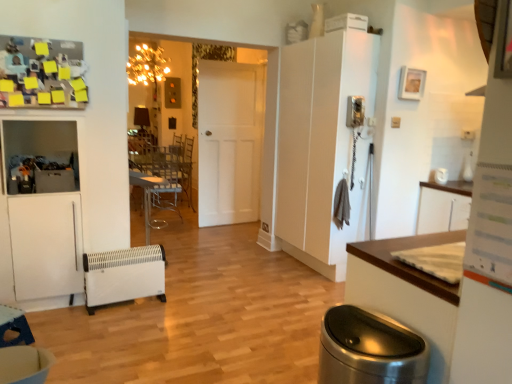
Question: Does polished stainless steel trash can at lower right contain white matte cabinet at right?

Choices:
 (A) yes
 (B) no

Answer: (B)

Question: Is there a large distance between polished stainless steel trash can at lower right and white matte cabinet at right?

Choices:
 (A) yes
 (B) no

Answer: (A)

Question: From a real-world perspective, does polished stainless steel trash can at lower right sit lower than white matte cabinet at right?

Choices:
 (A) yes
 (B) no

Answer: (A)

Question: Does polished stainless steel trash can at lower right have a lesser height compared to white matte cabinet at right?

Choices:
 (A) no
 (B) yes

Answer: (B)

Question: Does polished stainless steel trash can at lower right turn towards white matte cabinet at right?

Choices:
 (A) no
 (B) yes

Answer: (A)

Question: Considering the positions of white matte door at center and metallic silver table at center, arranged as the first table when viewed from the right, in the image, is white matte door at center wider or thinner than metallic silver table at center, arranged as the first table when viewed from the right,?

Choices:
 (A) thin
 (B) wide

Answer: (A)

Question: Is point (220, 110) closer or farther from the camera than point (155, 180)?

Choices:
 (A) farther
 (B) closer

Answer: (B)

Question: In the image, is white matte door at center positioned in front of or behind metallic silver table at center, arranged as the 2th table when ordered from the bottom?

Choices:
 (A) behind
 (B) front

Answer: (A)

Question: From the image's perspective, is white matte door at center located above or below metallic silver table at center, the 2th table in the left-to-right sequence?

Choices:
 (A) below
 (B) above

Answer: (B)

Question: Looking at their shapes, would you say wooden table at lower left, which appears as the 1th table when viewed from the front, is wider or thinner than polished stainless steel trash can at lower right?

Choices:
 (A) thin
 (B) wide

Answer: (B)

Question: Is wooden table at lower left, which is counted as the 2th table, starting from the right, bigger or smaller than polished stainless steel trash can at lower right?

Choices:
 (A) big
 (B) small

Answer: (B)

Question: Is wooden table at lower left, marked as the first table in a left-to-right arrangement, to the left or to the right of polished stainless steel trash can at lower right in the image?

Choices:
 (A) left
 (B) right

Answer: (A)

Question: Is point (10, 342) positioned closer to the camera than point (335, 314)?

Choices:
 (A) closer
 (B) farther

Answer: (B)

Question: Based on their positions, is clear plastic chair at center located to the left or right of metallic silver table at center, arranged as the first table when viewed from the right?

Choices:
 (A) right
 (B) left

Answer: (B)

Question: Looking at their shapes, would you say clear plastic chair at center is wider or thinner than metallic silver table at center, placed as the 2th table when sorted from front to back?

Choices:
 (A) wide
 (B) thin

Answer: (A)